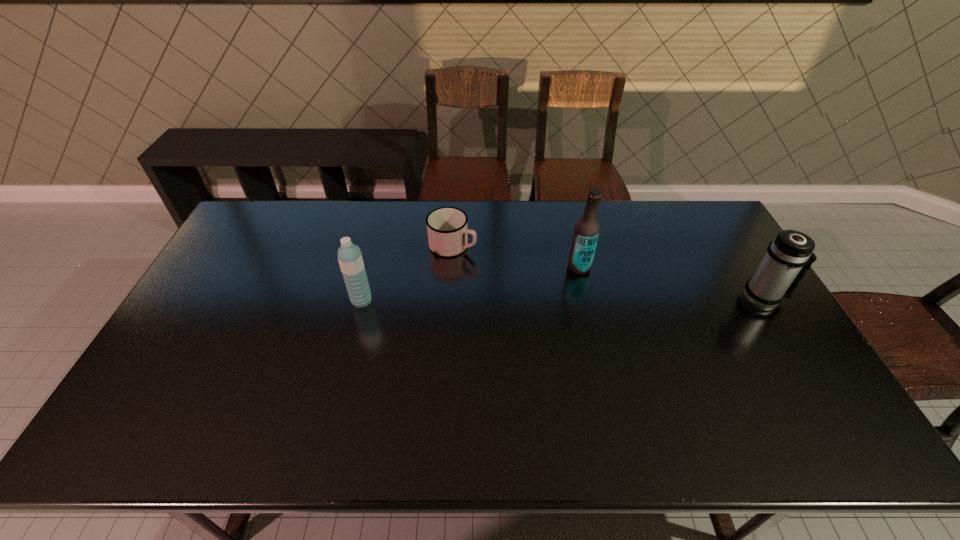
Locate an element on the screen. free space that is in between the rightmost object and the leftmost object is located at coordinates (563, 300).

I want to click on free space between the thermos bottle and the mug, so click(608, 272).

Where is `unoccupied area between the leftmost object and the rightmost object`? unoccupied area between the leftmost object and the rightmost object is located at coordinates (563, 300).

In order to click on free space that is in between the leftmost object and the thermos bottle in this screenshot , I will do `click(563, 300)`.

This screenshot has height=540, width=960. I want to click on free spot between the shortest object and the tallest object, so click(x=516, y=256).

Locate an element on the screen. empty location between the rightmost object and the water bottle is located at coordinates (563, 300).

Where is `empty space that is in between the tallest object and the rightmost object`? The image size is (960, 540). empty space that is in between the tallest object and the rightmost object is located at coordinates [671, 283].

The width and height of the screenshot is (960, 540). I want to click on vacant region between the beer bottle and the third object from right to left, so pos(516,256).

The image size is (960, 540). I want to click on vacant region between the water bottle and the rightmost object, so click(563, 300).

Select which object appears as the third closest to the beer bottle. Please provide its 2D coordinates. Your answer should be formatted as a tuple, i.e. [(x, y)], where the tuple contains the x and y coordinates of a point satisfying the conditions above.

[(350, 259)]